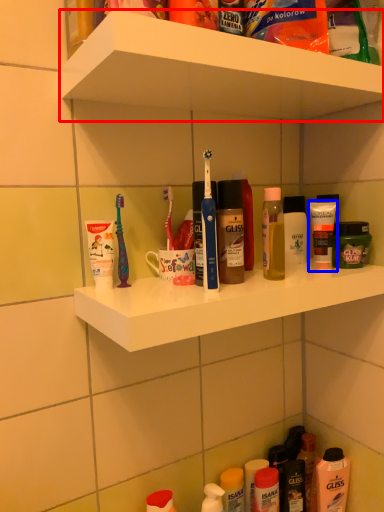
Question: Which point is further to the camera, supermarket shelf (highlighted by a red box) or toiletry (highlighted by a blue box)?

Choices:
 (A) supermarket shelf
 (B) toiletry

Answer: (B)